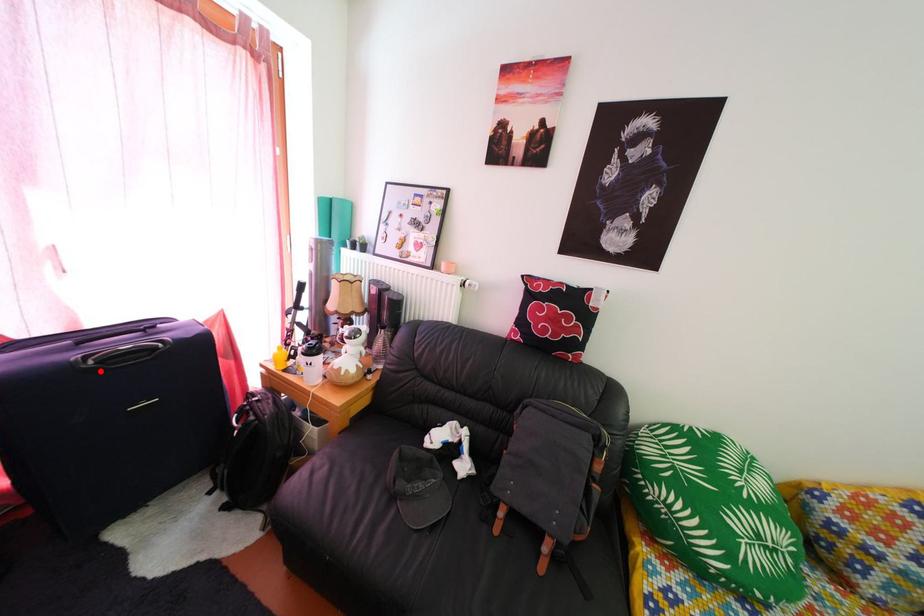
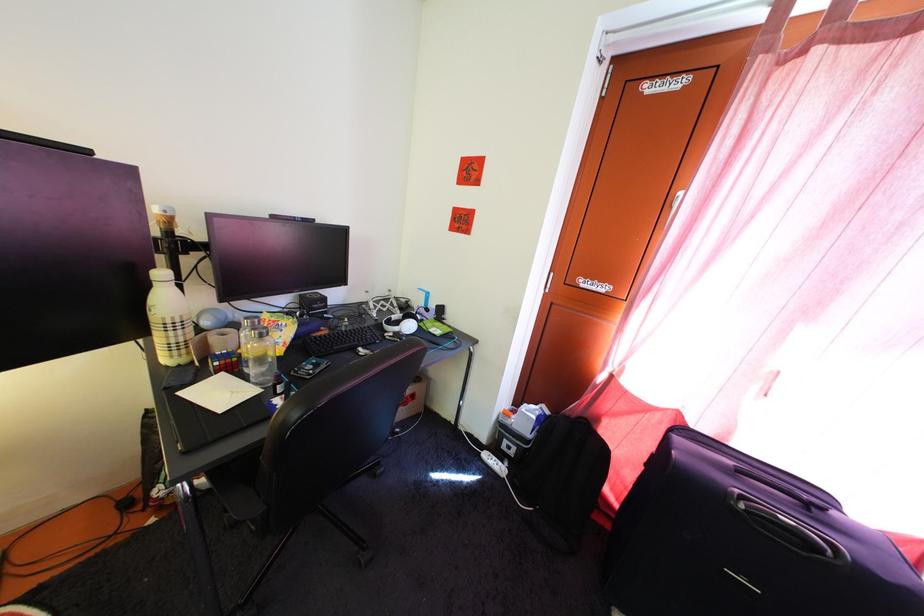
Where in the second image is the point corresponding to the highlighted location from the first image?

(751, 515)